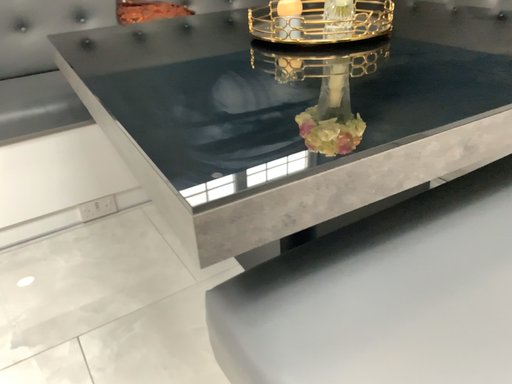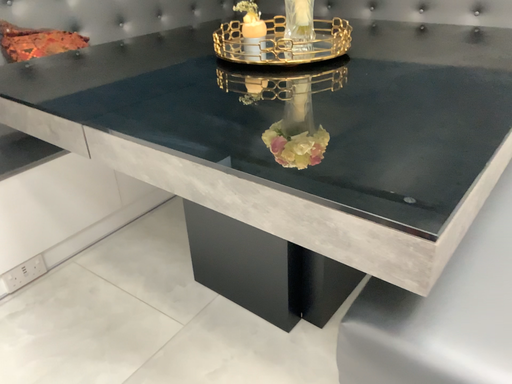
Question: Which way did the camera rotate in the video?

Choices:
 (A) rotated right
 (B) rotated left

Answer: (A)